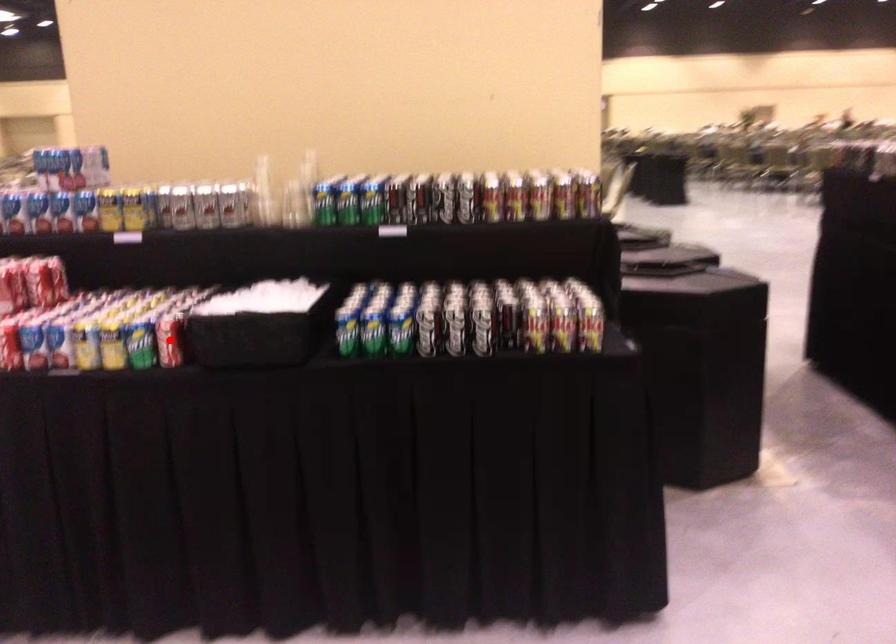
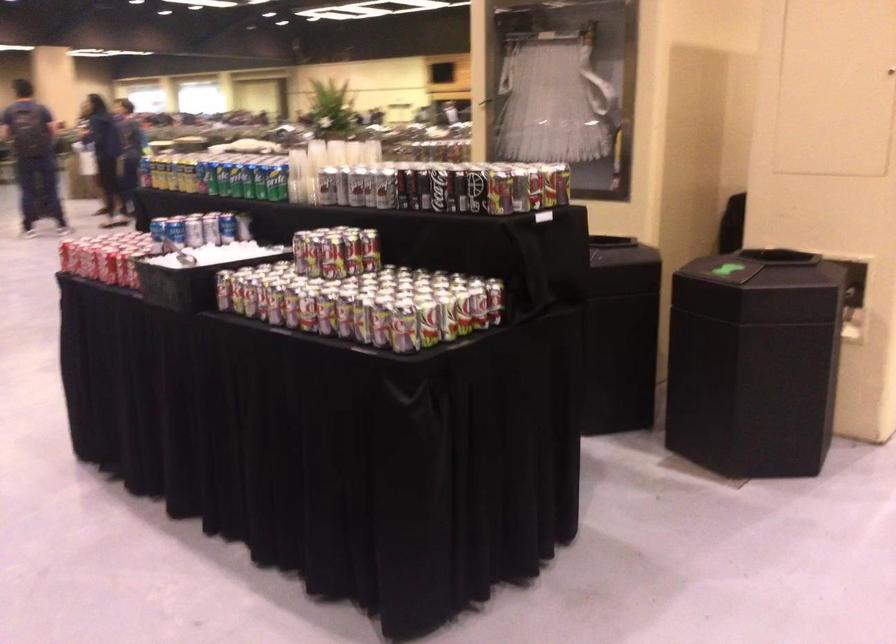
Question: I am providing you with two images of the same scene from different viewpoints. A red point is marked on the first image. Can you still see the location of the red point in image 2?

Choices:
 (A) Yes
 (B) No

Answer: (B)